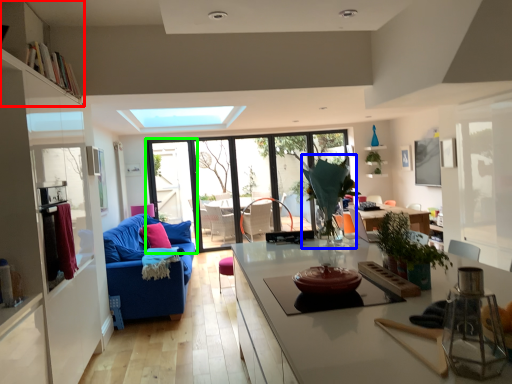
Question: Based on their relative distances, which object is nearer to shelf (highlighted by a red box)? Choose from plant (highlighted by a blue box) and screen door (highlighted by a green box).

Choices:
 (A) plant
 (B) screen door

Answer: (A)